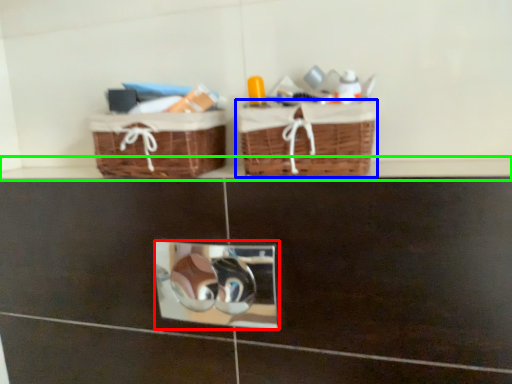
Question: Estimate the real-world distances between objects in this image. Which object is closer to mirror (highlighted by a red box), picnic basket (highlighted by a blue box) or ledge (highlighted by a green box)?

Choices:
 (A) picnic basket
 (B) ledge

Answer: (A)